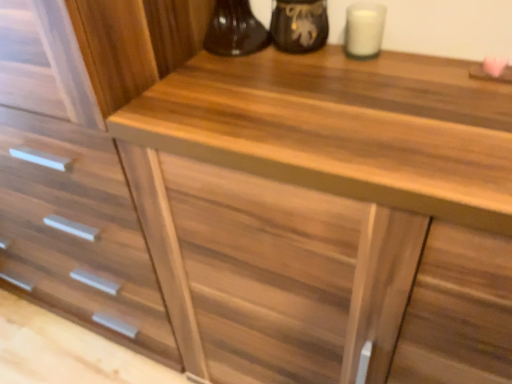
Question: Is white matte candle at upper right oriented away from matte black vase at upper center?

Choices:
 (A) yes
 (B) no

Answer: (B)

Question: From a real-world perspective, is white matte candle at upper right located beneath matte black vase at upper center?

Choices:
 (A) yes
 (B) no

Answer: (A)

Question: Is white matte candle at upper right surrounding matte black vase at upper center?

Choices:
 (A) yes
 (B) no

Answer: (B)

Question: Can you confirm if white matte candle at upper right is thinner than matte black vase at upper center?

Choices:
 (A) no
 (B) yes

Answer: (B)

Question: Can you confirm if white matte candle at upper right is positioned to the right of matte black vase at upper center?

Choices:
 (A) no
 (B) yes

Answer: (B)

Question: Do you think white matte candle at upper right is within matte black vase at upper center, or outside of it?

Choices:
 (A) inside
 (B) outside

Answer: (B)

Question: Is white matte candle at upper right taller or shorter than matte black vase at upper center?

Choices:
 (A) short
 (B) tall

Answer: (A)

Question: Is white matte candle at upper right wider or thinner than matte black vase at upper center?

Choices:
 (A) wide
 (B) thin

Answer: (B)

Question: Relative to matte black vase at upper center, is white matte candle at upper right in front or behind?

Choices:
 (A) front
 (B) behind

Answer: (A)

Question: From the image's perspective, is matte black vase at upper center positioned above or below white matte candle at upper right?

Choices:
 (A) below
 (B) above

Answer: (B)

Question: Based on their sizes in the image, would you say matte black vase at upper center is bigger or smaller than white matte candle at upper right?

Choices:
 (A) small
 (B) big

Answer: (B)

Question: Considering the positions of matte black vase at upper center and white matte candle at upper right in the image, is matte black vase at upper center wider or thinner than white matte candle at upper right?

Choices:
 (A) wide
 (B) thin

Answer: (A)

Question: In the image, is matte black vase at upper center positioned in front of or behind white matte candle at upper right?

Choices:
 (A) behind
 (B) front

Answer: (A)

Question: In terms of width, does wooden drawer at center look wider or thinner when compared to white matte candle at upper right?

Choices:
 (A) thin
 (B) wide

Answer: (B)

Question: Is wooden drawer at center taller or shorter than white matte candle at upper right?

Choices:
 (A) short
 (B) tall

Answer: (B)